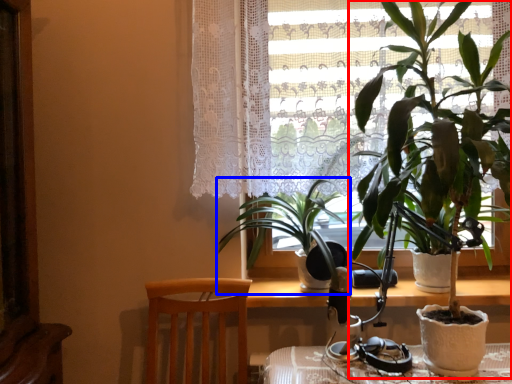
Question: Which point is closer to the camera, houseplant (highlighted by a red box) or houseplant (highlighted by a blue box)?

Choices:
 (A) houseplant
 (B) houseplant

Answer: (A)